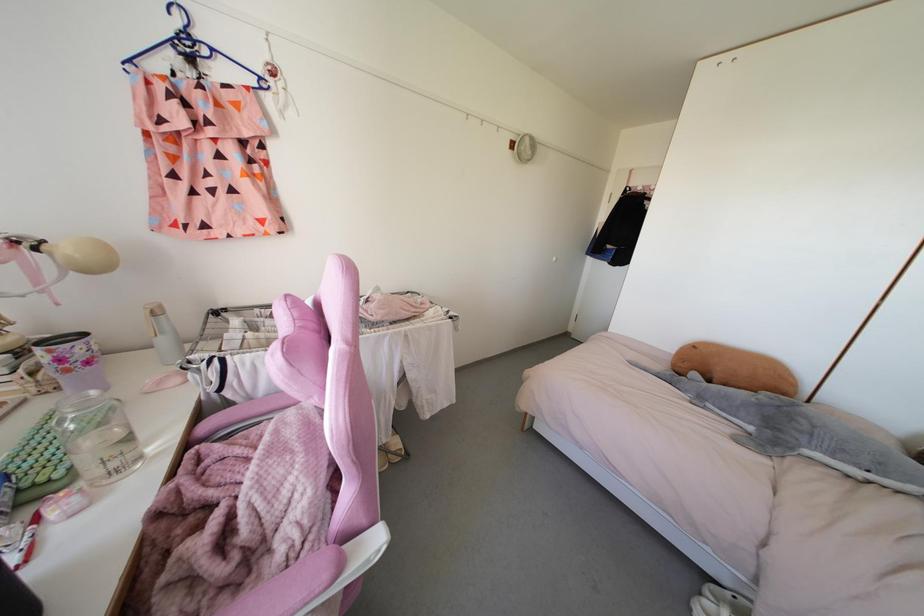
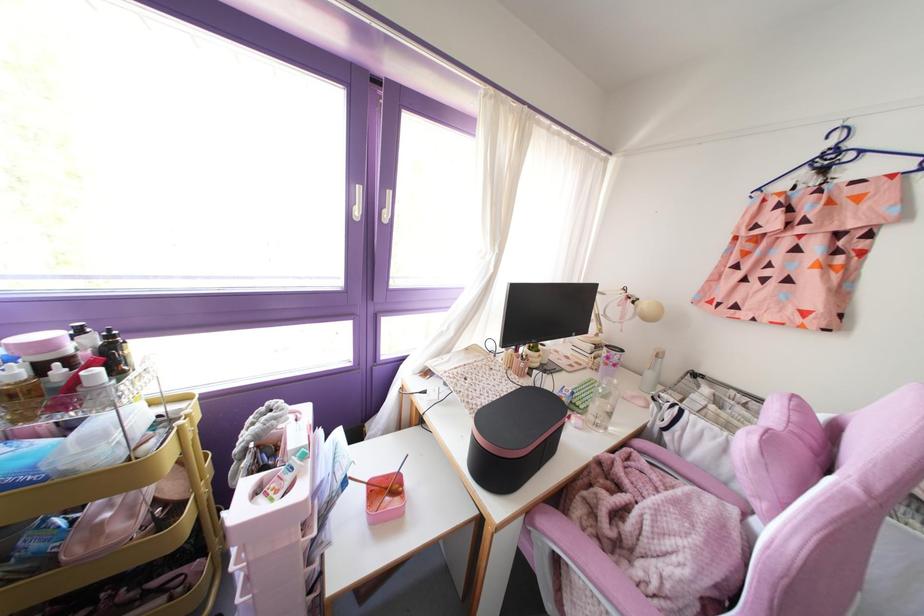
The point at (92, 392) is marked in the first image. Where is the corresponding point in the second image?

(614, 381)